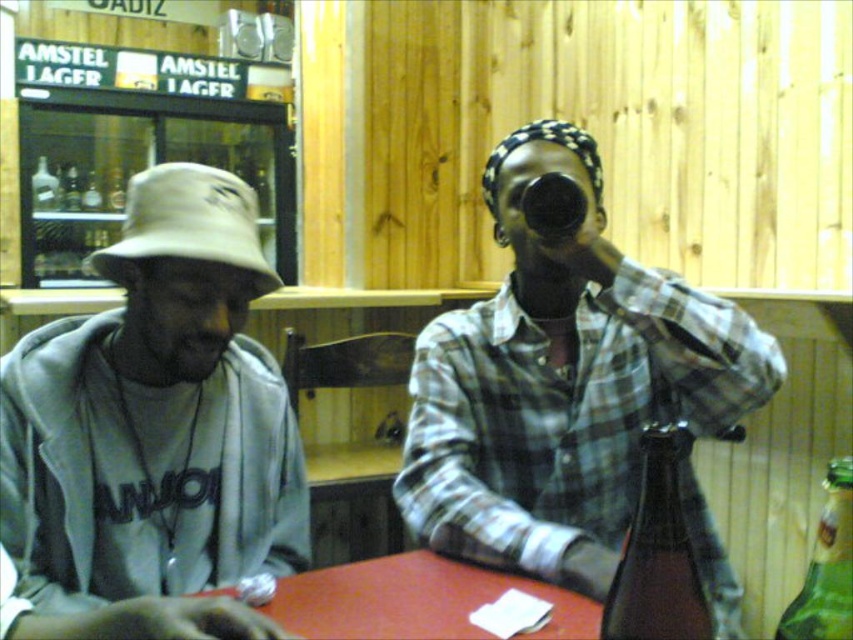
You are a tailor measuring clothing for alterations. You have a gray cotton hoodie at left that needs to be adjusted to fit over a smooth red table at center. Can the hoodie be stretched enough to cover the table?

The gray cotton hoodie at left is narrower than the smooth red table at center, so stretching it might not be sufficient to fully cover the table.

You are a customer at this bar and want to place your phone on the table. The gray cotton hoodie at left is currently occupying space on the table. Is there enough room left on the table for your phone?

The gray cotton hoodie at left is located at point (154, 413), which leaves sufficient space on the table for placing a phone.